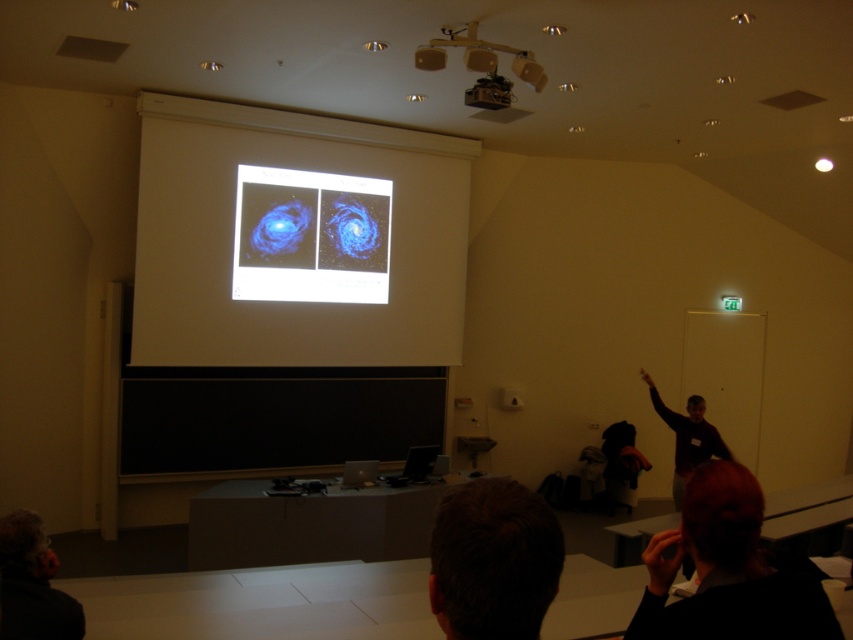
Question: Is black matte/blackboard at center thinner than black fabric at lower right?

Choices:
 (A) no
 (B) yes

Answer: (A)

Question: Considering the real-world distances, which object is closest to the dark hair at lower left?

Choices:
 (A) black matte/blackboard at center
 (B) black fabric at lower right
 (C) white matte projection screen at upper center
 (D) brown hair at lower center

Answer: (D)

Question: Considering the real-world distances, which object is closest to the black fabric at lower right?

Choices:
 (A) dark hair at lower left
 (B) matte black projector at upper center
 (C) black matte/blackboard at center

Answer: (A)

Question: Is blue matte galaxy at upper center positioned in front of brown hair at lower center?

Choices:
 (A) no
 (B) yes

Answer: (A)

Question: Which of the following is the farthest from the observer?

Choices:
 (A) blue matte galaxy at upper center
 (B) matte black projector at upper center

Answer: (A)

Question: Is black matte/blackboard at center smaller than dark hair at lower left?

Choices:
 (A) no
 (B) yes

Answer: (A)